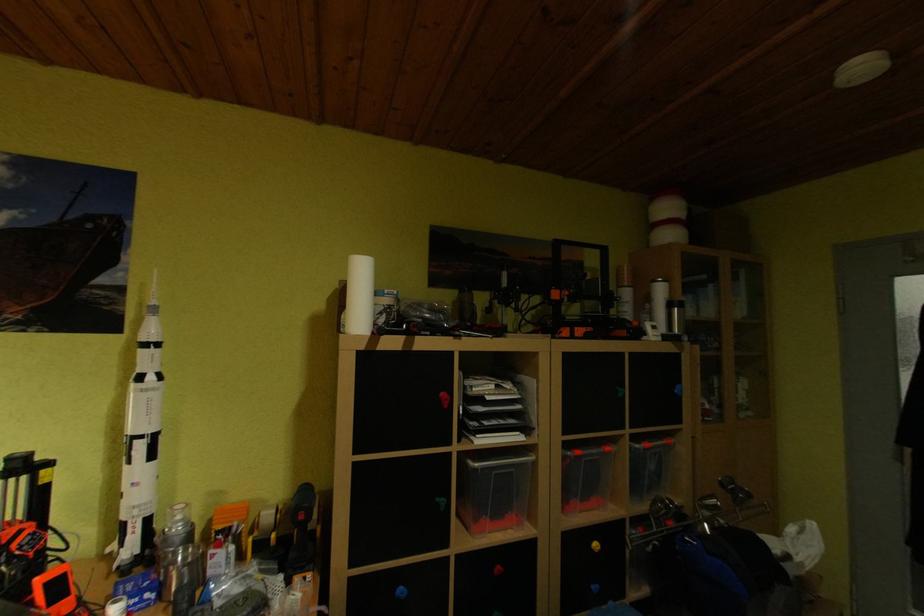
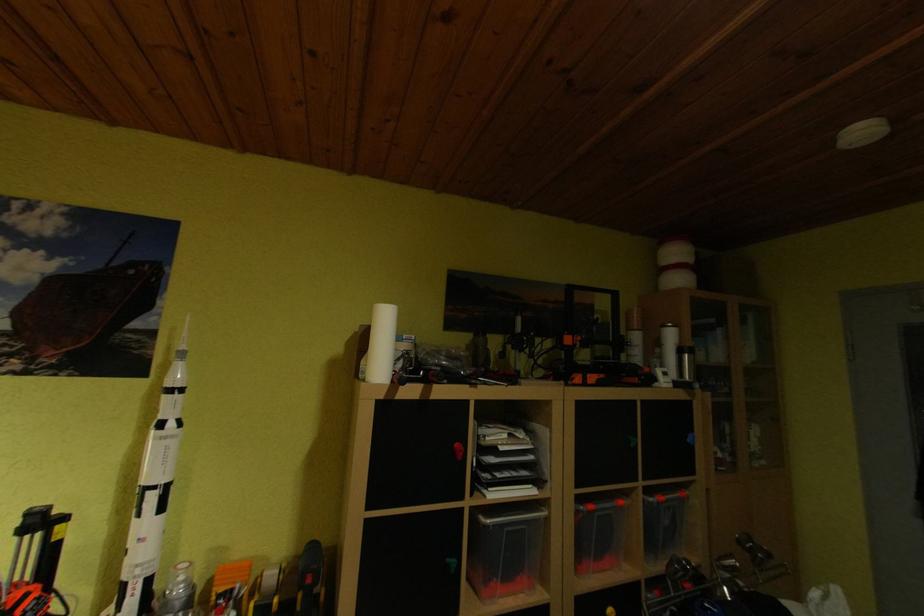
Question: The images are taken continuously from a first-person perspective. In which direction is your viewpoint rotating?

Choices:
 (A) Left
 (B) Right
 (C) Up
 (D) Down

Answer: (C)